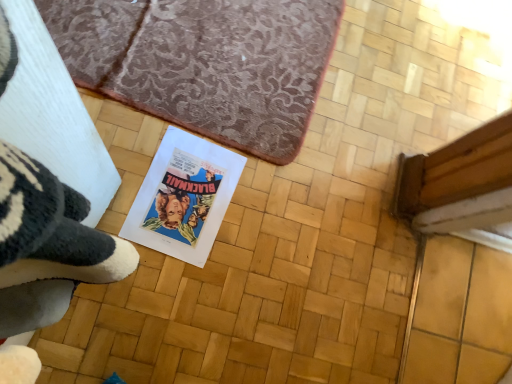
Where is `free spot behind matte paper book at center`? The height and width of the screenshot is (384, 512). free spot behind matte paper book at center is located at coordinates (252, 135).